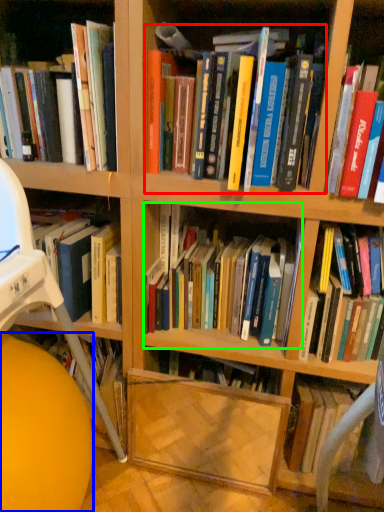
Question: Based on their relative distances, which object is nearer to book (highlighted by a red box)? Choose from ball (highlighted by a blue box) and book (highlighted by a green box).

Choices:
 (A) ball
 (B) book

Answer: (B)